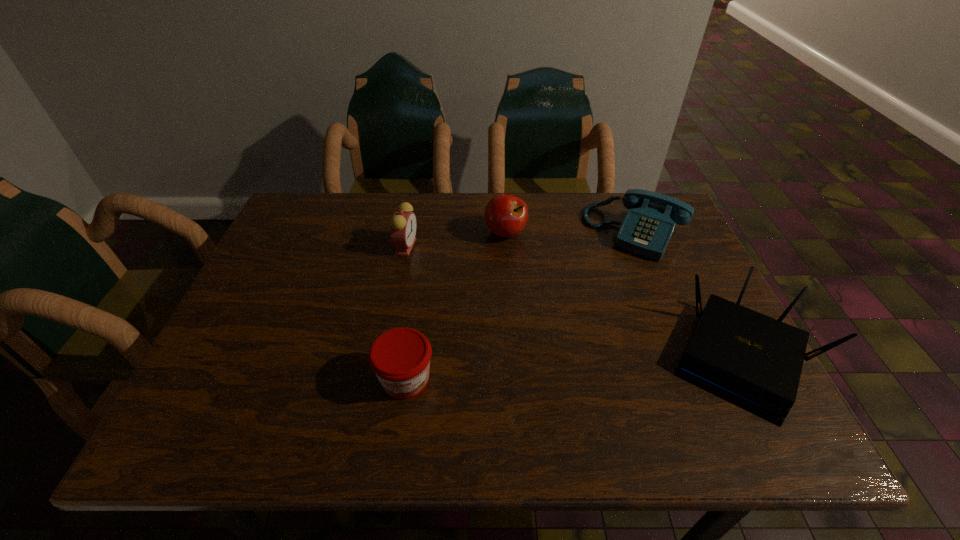
The width and height of the screenshot is (960, 540). What are the coordinates of `free spot between the alarm clock and the jam` in the screenshot? It's located at (405, 313).

This screenshot has height=540, width=960. Find the location of `free spot between the jam and the third object from right to left`. free spot between the jam and the third object from right to left is located at coordinates (455, 306).

The image size is (960, 540). Identify the location of free space that is in between the telephone and the apple. (570, 233).

Locate an element on the screen. free spot between the jam and the alarm clock is located at coordinates (405, 313).

In order to click on free space between the jam and the apple in this screenshot , I will do `click(455, 306)`.

Locate an element on the screen. This screenshot has width=960, height=540. free space between the third object from right to left and the router is located at coordinates (624, 296).

Identify the location of vacant region between the apple and the alarm clock. The height and width of the screenshot is (540, 960). (455, 239).

The image size is (960, 540). Identify the location of unoccupied area between the telephone and the alarm clock. (519, 239).

I want to click on free space between the telephone and the alarm clock, so click(x=519, y=239).

Identify which object is located as the third nearest to the jam. Please provide its 2D coordinates. Your answer should be formatted as a tuple, i.e. [(x, y)], where the tuple contains the x and y coordinates of a point satisfying the conditions above.

[(646, 230)]